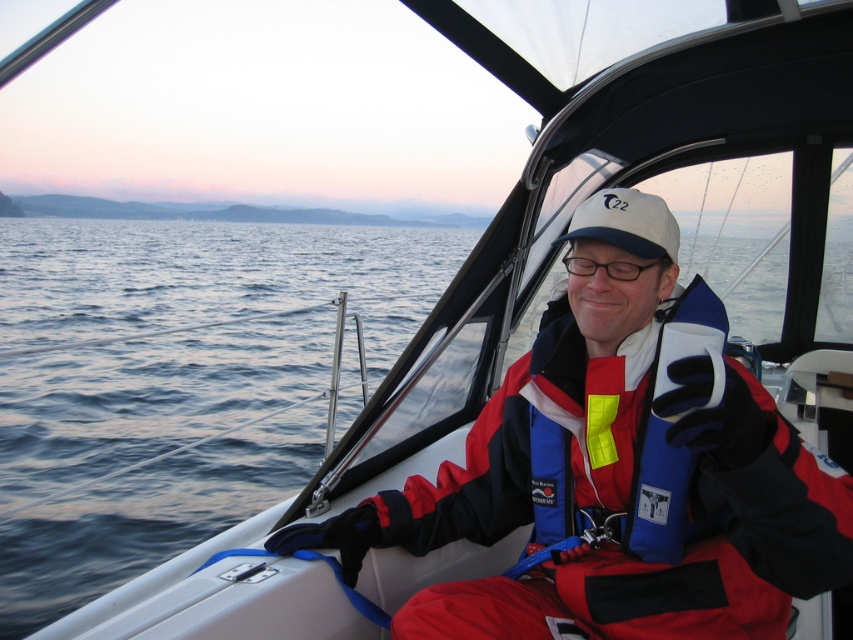
Question: Does red fabric jacket at center appear on the left side of transparent plastic glasses at center?

Choices:
 (A) no
 (B) yes

Answer: (B)

Question: Is red fabric jacket at center closer to camera compared to transparent plastic glasses at center?

Choices:
 (A) yes
 (B) no

Answer: (A)

Question: From the image, what is the correct spatial relationship of red fabric jacket at center in relation to transparent plastic glasses at center?

Choices:
 (A) right
 (B) left

Answer: (B)

Question: Among these objects, which one is farthest from the camera?

Choices:
 (A) transparent plastic glasses at center
 (B) red fabric jacket at center

Answer: (A)